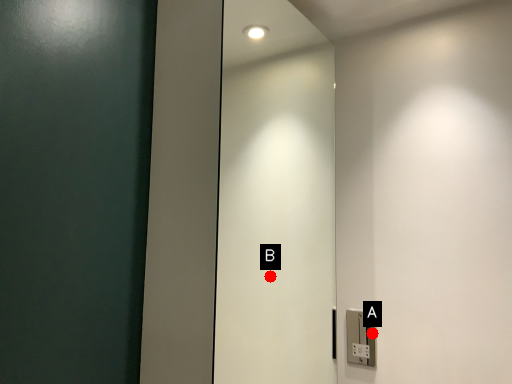
Question: Two points are circled on the image, labeled by A and B beside each circle. Which point is closer to the camera?

Choices:
 (A) A is closer
 (B) B is closer

Answer: (A)